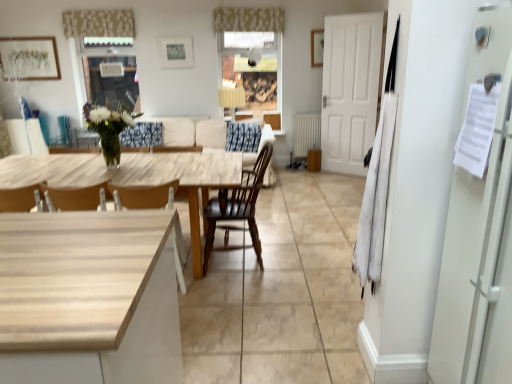
Where is `free space to the right of wooden chair at center, the second chair from the right`? The image size is (512, 384). free space to the right of wooden chair at center, the second chair from the right is located at coordinates (211, 291).